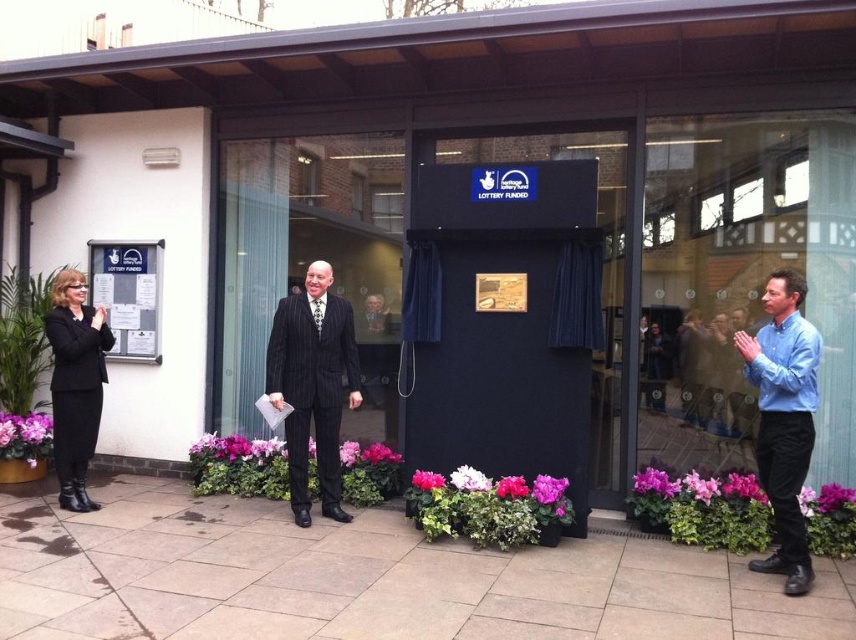
Can you confirm if blue fabric curtain at center is bigger than blue shirt at right?

Correct, blue fabric curtain at center is larger in size than blue shirt at right.

This screenshot has width=856, height=640. What are the coordinates of `blue fabric curtain at center` in the screenshot? It's located at (742, 280).

Is point (687, 278) in front of point (798, 317)?

No, it is behind (798, 317).

I want to click on blue fabric curtain at center, so click(742, 280).

Who is positioned more to the left, blue fabric curtain at center or black leather jacket at left?

From the viewer's perspective, black leather jacket at left appears more on the left side.

Can you confirm if blue fabric curtain at center is positioned to the left of black leather jacket at left?

No, blue fabric curtain at center is not to the left of black leather jacket at left.

What do you see at coordinates (742, 280) in the screenshot?
I see `blue fabric curtain at center` at bounding box center [742, 280].

Find the location of `blue fabric curtain at center`. blue fabric curtain at center is located at coordinates (742, 280).

Is blue shirt at right closer to the viewer compared to pinstriped suit at center?

That is True.

Is point (789, 518) positioned before point (306, 291)?

That is True.

This screenshot has height=640, width=856. Describe the element at coordinates (783, 419) in the screenshot. I see `blue shirt at right` at that location.

The width and height of the screenshot is (856, 640). Identify the location of blue shirt at right. (783, 419).